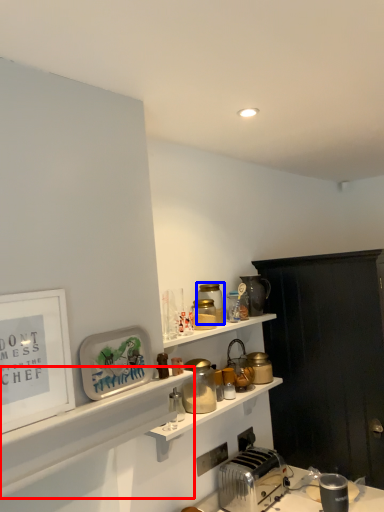
Question: Which object appears farthest to the camera in this image, shelf (highlighted by a red box) or appliance (highlighted by a blue box)?

Choices:
 (A) shelf
 (B) appliance

Answer: (B)